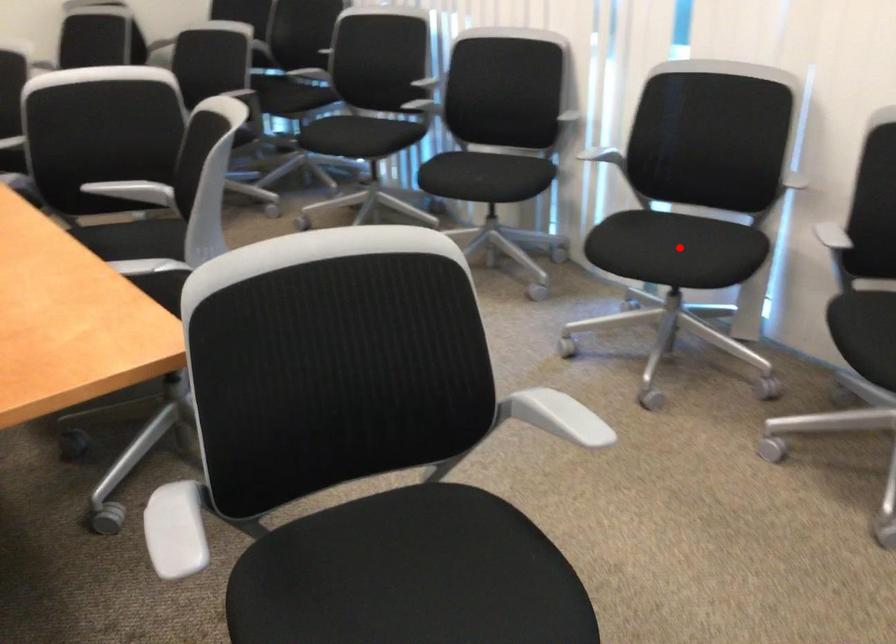
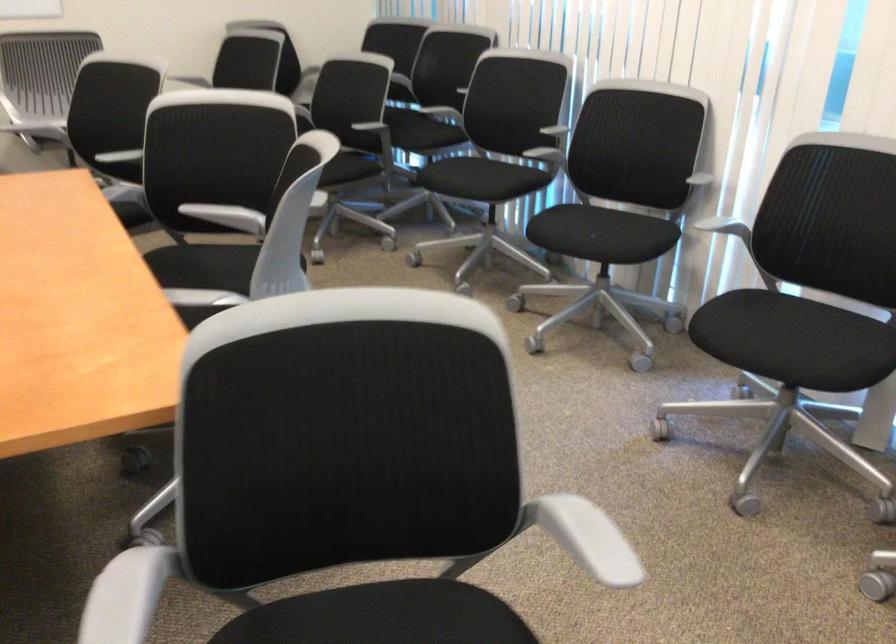
Question: I am providing you with two images of the same scene from different viewpoints. A red point is shown in image1. For the corresponding object point in image2, is it positioned nearer or farther from the camera?

Choices:
 (A) Nearer
 (B) Farther

Answer: (A)